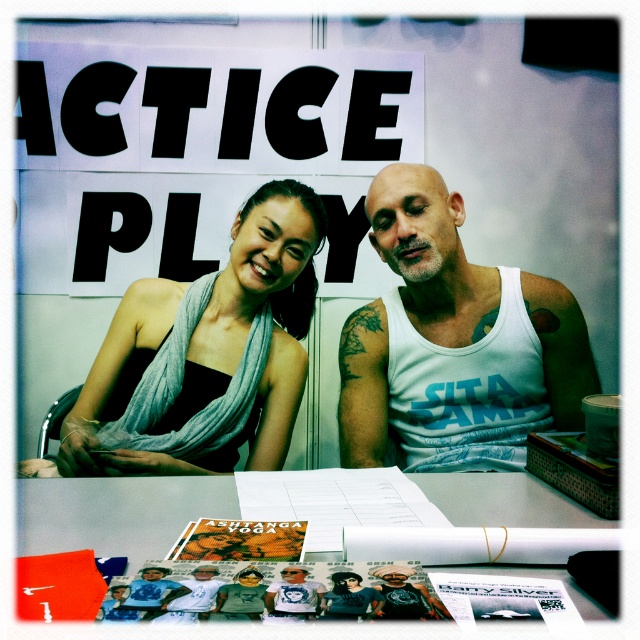
Question: Can you confirm if matte white tank top at center is positioned above white paper at center?

Choices:
 (A) yes
 (B) no

Answer: (A)

Question: Does matte black dress at center have a lesser width compared to white paper at center?

Choices:
 (A) yes
 (B) no

Answer: (B)

Question: Which point appears closest to the camera in this image?

Choices:
 (A) (550, 508)
 (B) (461, 321)
 (C) (108, 356)

Answer: (A)

Question: Which object appears closest to the camera in this image?

Choices:
 (A) white cotton tank top at center
 (B) white paper at center

Answer: (B)

Question: Based on their relative distances, which object is nearer to the white paper at center?

Choices:
 (A) matte black dress at center
 (B) white cotton tank top at center

Answer: (A)

Question: Can you confirm if matte white tank top at center is positioned above white cotton tank top at center?

Choices:
 (A) no
 (B) yes

Answer: (B)